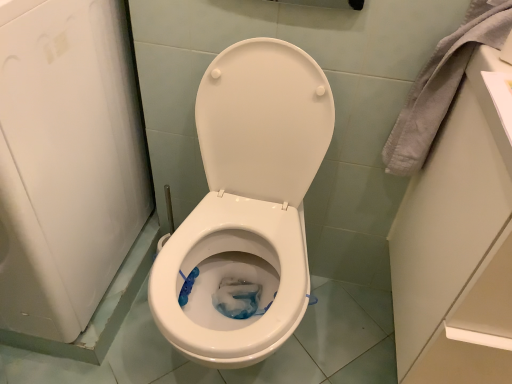
The height and width of the screenshot is (384, 512). What do you see at coordinates (248, 201) in the screenshot? I see `white glossy toilet at center` at bounding box center [248, 201].

Where is `white glossy toilet at center`? white glossy toilet at center is located at coordinates (248, 201).

Where is `gray fabric towel at upper right`? The image size is (512, 384). gray fabric towel at upper right is located at coordinates (442, 85).

What do you see at coordinates (442, 85) in the screenshot? The width and height of the screenshot is (512, 384). I see `gray fabric towel at upper right` at bounding box center [442, 85].

Where is `white glossy toilet at center`? The height and width of the screenshot is (384, 512). white glossy toilet at center is located at coordinates (248, 201).

Between gray fabric towel at upper right and white glossy toilet at center, which one appears on the right side from the viewer's perspective?

From the viewer's perspective, gray fabric towel at upper right appears more on the right side.

Between gray fabric towel at upper right and white glossy toilet at center, which one is positioned in front?

Positioned in front is white glossy toilet at center.

Does point (459, 66) appear closer or farther from the camera than point (241, 111)?

Point (459, 66).

From the image's perspective, which is below, gray fabric towel at upper right or white glossy toilet at center?

white glossy toilet at center, from the image's perspective.

From a real-world perspective, which object rests below the other?

white glossy toilet at center, from a real-world perspective.

Can you confirm if gray fabric towel at upper right is thinner than white glossy toilet at center?

Yes.

Can you confirm if gray fabric towel at upper right is shorter than white glossy toilet at center?

Correct, gray fabric towel at upper right is not as tall as white glossy toilet at center.

Who is bigger, gray fabric towel at upper right or white glossy toilet at center?

Bigger between the two is white glossy toilet at center.

Would you say white glossy toilet at center is part of gray fabric towel at upper right's contents?

Actually, white glossy toilet at center is outside gray fabric towel at upper right.

Is gray fabric towel at upper right with white glossy toilet at center?

No, gray fabric towel at upper right is not making contact with white glossy toilet at center.

Is gray fabric towel at upper right facing away from white glossy toilet at center?

No, gray fabric towel at upper right is not facing the opposite direction of white glossy toilet at center.

Identify the location of toilet that appears in front of the gray fabric towel at upper right. (248, 201).

Can you confirm if white glossy toilet at center is positioned to the right of gray fabric towel at upper right?

In fact, white glossy toilet at center is to the left of gray fabric towel at upper right.

In the image, is white glossy toilet at center positioned in front of or behind gray fabric towel at upper right?

Clearly, white glossy toilet at center is in front of gray fabric towel at upper right.

Considering the positions of points (226, 203) and (415, 150), is point (226, 203) closer to camera compared to point (415, 150)?

That is False.

From the image's perspective, is white glossy toilet at center located beneath gray fabric towel at upper right?

Correct, white glossy toilet at center appears lower than gray fabric towel at upper right in the image.

From a real-world perspective, which is physically below, white glossy toilet at center or gray fabric towel at upper right?

white glossy toilet at center, from a real-world perspective.

Considering the sizes of objects white glossy toilet at center and gray fabric towel at upper right in the image provided, who is wider, white glossy toilet at center or gray fabric towel at upper right?

white glossy toilet at center.

Considering the sizes of objects white glossy toilet at center and gray fabric towel at upper right in the image provided, who is shorter, white glossy toilet at center or gray fabric towel at upper right?

gray fabric towel at upper right is shorter.

Is white glossy toilet at center smaller than gray fabric towel at upper right?

No, white glossy toilet at center is not smaller than gray fabric towel at upper right.

Looking at this image, does white glossy toilet at center contain gray fabric towel at upper right?

No, gray fabric towel at upper right is not a part of white glossy toilet at center.

Is white glossy toilet at center far from gray fabric towel at upper right?

white glossy toilet at center is near gray fabric towel at upper right, not far away.

Could you tell me if white glossy toilet at center is facing gray fabric towel at upper right?

No, white glossy toilet at center is not turned towards gray fabric towel at upper right.

What's the angular difference between white glossy toilet at center and gray fabric towel at upper right's facing directions?

The facing directions of white glossy toilet at center and gray fabric towel at upper right are 0.961 degrees apart.

Measure the distance from white glossy toilet at center to gray fabric towel at upper right.

white glossy toilet at center is 14.55 inches away from gray fabric towel at upper right.

The width and height of the screenshot is (512, 384). What are the coordinates of `material above the white glossy toilet at center (from the image's perspective)` in the screenshot? It's located at (442, 85).

In the image, there is a gray fabric towel at upper right. What are the coordinates of `toilet below it (from the image's perspective)` in the screenshot? It's located at (248, 201).

Locate an element on the screen. The height and width of the screenshot is (384, 512). material behind the white glossy toilet at center is located at coordinates (442, 85).